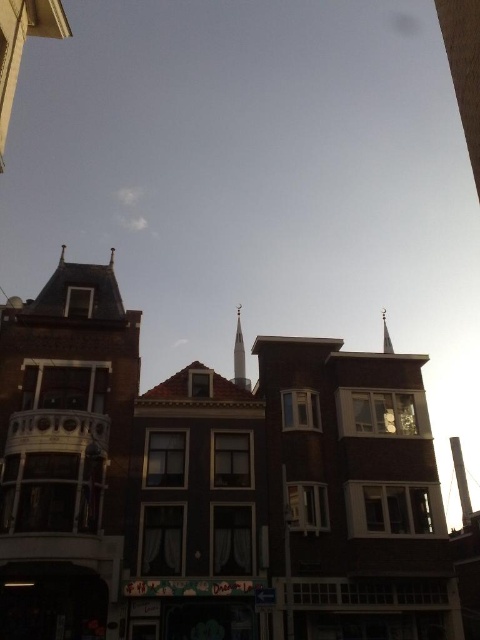
Question: Does white glossy spire at center have a smaller size compared to silver metallic spire at upper center?

Choices:
 (A) no
 (B) yes

Answer: (B)

Question: Which object is the closest to the smooth silver spire at right?

Choices:
 (A) brick tower at left
 (B) silver metallic spire at upper center

Answer: (B)

Question: In this image, where is white glossy spire at center located relative to silver metallic spire at upper center?

Choices:
 (A) above
 (B) below

Answer: (B)

Question: Is brick tower at left wider than silver metallic spire at upper center?

Choices:
 (A) yes
 (B) no

Answer: (B)

Question: Which point is closer to the camera?

Choices:
 (A) (383, 344)
 (B) (84, 520)

Answer: (B)

Question: Which object is closer to the camera taking this photo?

Choices:
 (A) silver metallic spire at upper center
 (B) smooth silver spire at right

Answer: (A)